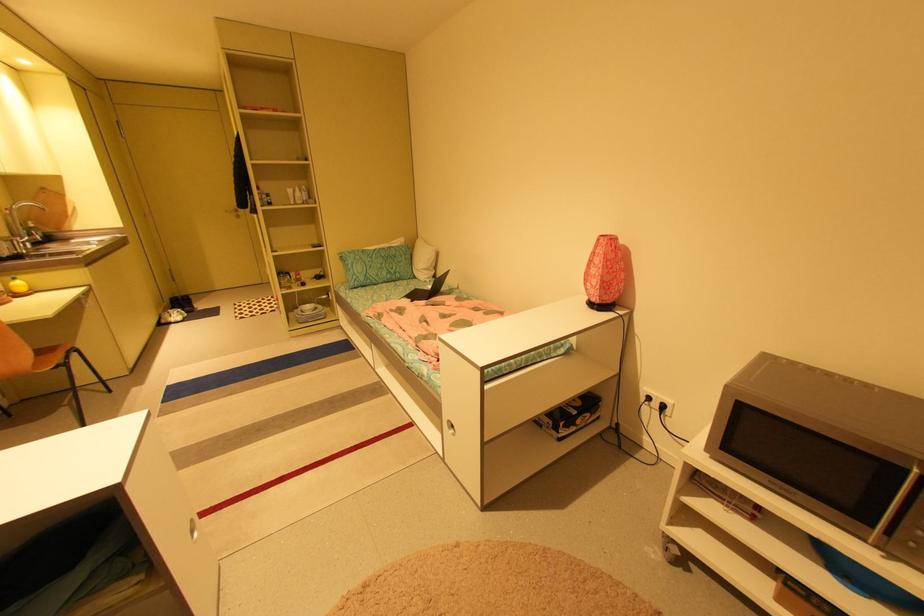
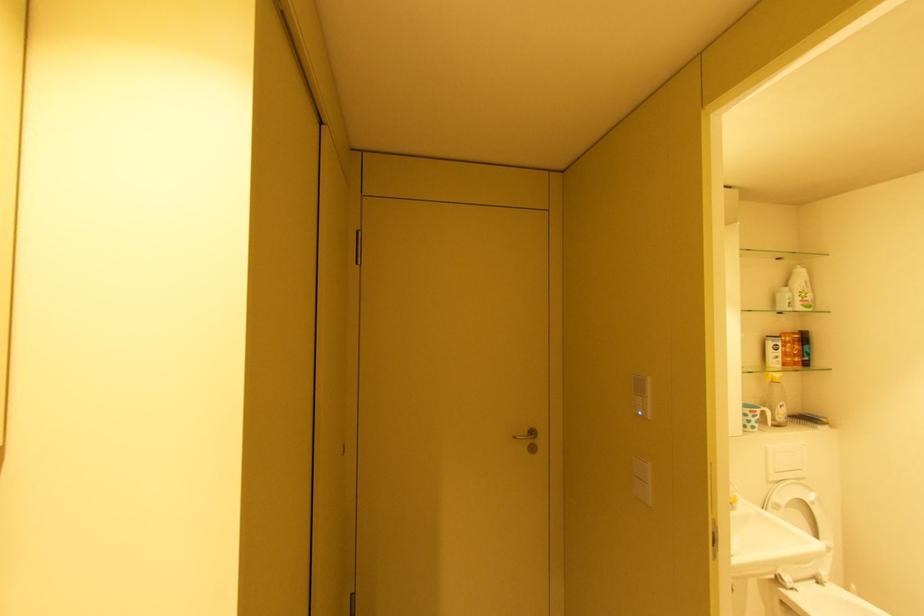
In the second image, find the point that corresponds to point (232, 211) in the first image.

(520, 438)